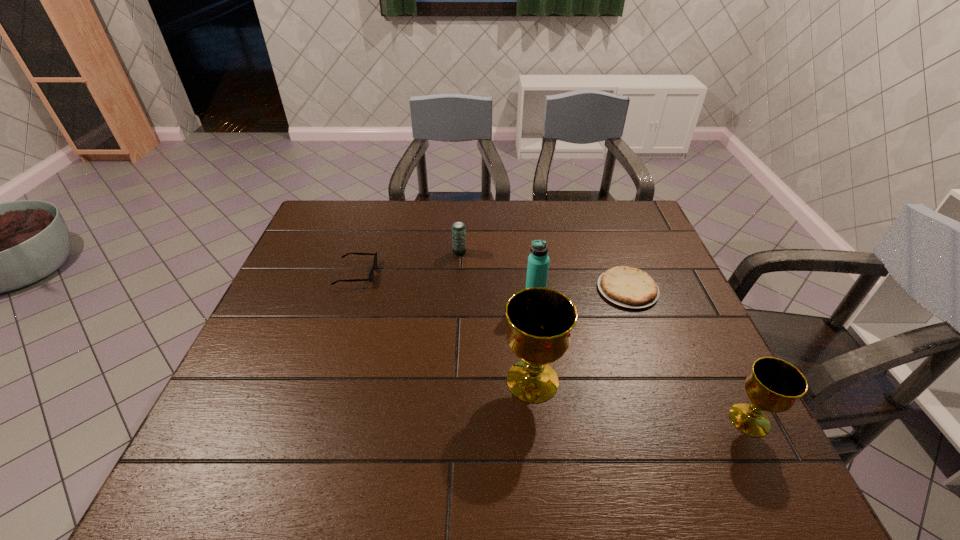
In order to click on free point that keeps the chalices evenly spaced on the left in this screenshot , I will do `click(346, 347)`.